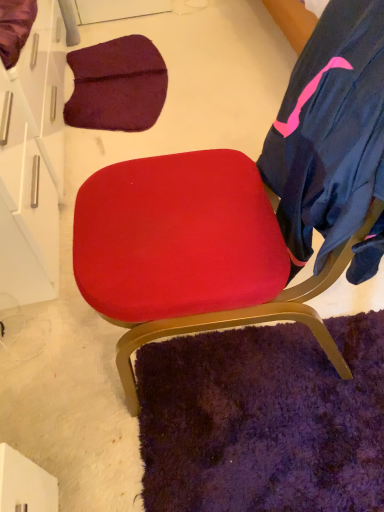
Question: From the image's perspective, is suede red chair at center on dark blue fabric robe at right?

Choices:
 (A) yes
 (B) no

Answer: (B)

Question: From a real-world perspective, is suede red chair at center located beneath dark blue fabric robe at right?

Choices:
 (A) yes
 (B) no

Answer: (A)

Question: Considering the relative positions of suede red chair at center and dark blue fabric robe at right in the image provided, is suede red chair at center behind dark blue fabric robe at right?

Choices:
 (A) yes
 (B) no

Answer: (B)

Question: Is suede red chair at center shorter than dark blue fabric robe at right?

Choices:
 (A) yes
 (B) no

Answer: (B)

Question: Is suede red chair at center bigger than dark blue fabric robe at right?

Choices:
 (A) no
 (B) yes

Answer: (B)

Question: Considering the relative sizes of suede red chair at center and dark blue fabric robe at right in the image provided, is suede red chair at center smaller than dark blue fabric robe at right?

Choices:
 (A) no
 (B) yes

Answer: (A)

Question: Can you confirm if suede red chair at center is wider than white glossy drawer at upper left?

Choices:
 (A) no
 (B) yes

Answer: (B)

Question: Is suede red chair at center bigger than white glossy drawer at upper left?

Choices:
 (A) yes
 (B) no

Answer: (A)

Question: Can you confirm if suede red chair at center is smaller than white glossy drawer at upper left?

Choices:
 (A) yes
 (B) no

Answer: (B)

Question: From a real-world perspective, is suede red chair at center physically above white glossy drawer at upper left?

Choices:
 (A) no
 (B) yes

Answer: (B)

Question: Is suede red chair at center aimed at white glossy drawer at upper left?

Choices:
 (A) no
 (B) yes

Answer: (A)

Question: Considering the relative positions of suede red chair at center and white glossy drawer at upper left in the image provided, is suede red chair at center to the right of white glossy drawer at upper left from the viewer's perspective?

Choices:
 (A) no
 (B) yes

Answer: (B)

Question: Does white glossy drawer at upper left come behind dark blue fabric robe at right?

Choices:
 (A) yes
 (B) no

Answer: (A)